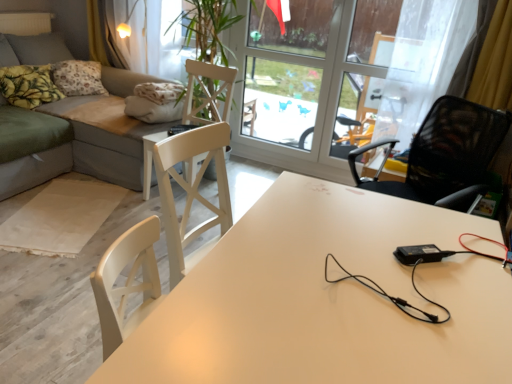
Question: From the image's perspective, does yellow printed fabric pillow at upper left, which is the first pillow in front-to-back order, appear lower than yellow printed fabric pillow at upper left, the first pillow viewed from the back?

Choices:
 (A) no
 (B) yes

Answer: (B)

Question: Is the position of yellow printed fabric pillow at upper left, the second pillow when ordered from back to front, more distant than that of yellow printed fabric pillow at upper left, the first pillow viewed from the back?

Choices:
 (A) yes
 (B) no

Answer: (B)

Question: Considering the relative positions of yellow printed fabric pillow at upper left, which is the first pillow in front-to-back order, and yellow printed fabric pillow at upper left, which appears as the second pillow when viewed from the front, in the image provided, is yellow printed fabric pillow at upper left, which is the first pillow in front-to-back order, to the right of yellow printed fabric pillow at upper left, which appears as the second pillow when viewed from the front, from the viewer's perspective?

Choices:
 (A) no
 (B) yes

Answer: (A)

Question: Considering the relative sizes of yellow printed fabric pillow at upper left, the second pillow when ordered from back to front, and yellow printed fabric pillow at upper left, which appears as the second pillow when viewed from the front, in the image provided, is yellow printed fabric pillow at upper left, the second pillow when ordered from back to front, bigger than yellow printed fabric pillow at upper left, which appears as the second pillow when viewed from the front,?

Choices:
 (A) no
 (B) yes

Answer: (A)

Question: Considering the relative sizes of yellow printed fabric pillow at upper left, which is the first pillow in front-to-back order, and yellow printed fabric pillow at upper left, which appears as the second pillow when viewed from the front, in the image provided, is yellow printed fabric pillow at upper left, which is the first pillow in front-to-back order, shorter than yellow printed fabric pillow at upper left, which appears as the second pillow when viewed from the front,?

Choices:
 (A) yes
 (B) no

Answer: (A)

Question: Considering their positions, is yellow printed fabric pillow at upper left, the second pillow when ordered from back to front, located in front of or behind transparent glass window at upper center?

Choices:
 (A) front
 (B) behind

Answer: (A)

Question: Is yellow printed fabric pillow at upper left, the second pillow when ordered from back to front, inside the boundaries of transparent glass window at upper center, or outside?

Choices:
 (A) inside
 (B) outside

Answer: (B)

Question: Considering the positions of yellow printed fabric pillow at upper left, which is the first pillow in front-to-back order, and transparent glass window at upper center in the image, is yellow printed fabric pillow at upper left, which is the first pillow in front-to-back order, wider or thinner than transparent glass window at upper center?

Choices:
 (A) thin
 (B) wide

Answer: (B)

Question: From the image's perspective, is yellow printed fabric pillow at upper left, the second pillow when ordered from back to front, above or below transparent glass window at upper center?

Choices:
 (A) below
 (B) above

Answer: (A)

Question: Relative to white glossy table at center, is white wood chair at center, marked as the second chair in a front-to-back arrangement, in front or behind?

Choices:
 (A) behind
 (B) front

Answer: (A)

Question: From the image's perspective, is white wood chair at center, the first chair viewed from the left, above or below white glossy table at center?

Choices:
 (A) below
 (B) above

Answer: (B)

Question: Is white wood chair at center, which appears as the 2th chair when viewed from the right, to the left or to the right of white glossy table at center in the image?

Choices:
 (A) left
 (B) right

Answer: (A)

Question: From a real-world perspective, is white wood chair at center, the 1th chair viewed from the back, above or below white glossy table at center?

Choices:
 (A) below
 (B) above

Answer: (B)

Question: Considering the positions of gray fabric couch at left and yellow printed fabric pillow at upper left, the first pillow viewed from the back, in the image, is gray fabric couch at left taller or shorter than yellow printed fabric pillow at upper left, the first pillow viewed from the back,?

Choices:
 (A) tall
 (B) short

Answer: (A)

Question: Considering the relative positions of gray fabric couch at left and yellow printed fabric pillow at upper left, which appears as the second pillow when viewed from the front, in the image provided, is gray fabric couch at left to the left or to the right of yellow printed fabric pillow at upper left, which appears as the second pillow when viewed from the front,?

Choices:
 (A) left
 (B) right

Answer: (B)